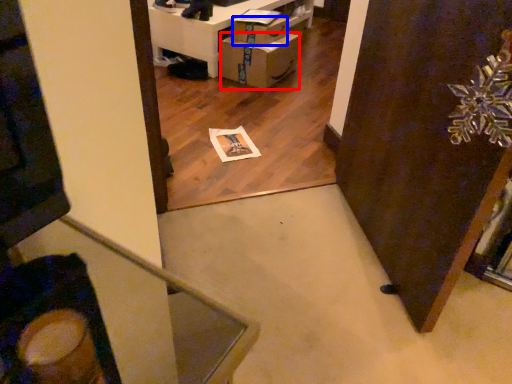
Question: Which of the following is the closest to the observer, cardboard box (highlighted by a red box) or drawer (highlighted by a blue box)?

Choices:
 (A) cardboard box
 (B) drawer

Answer: (A)